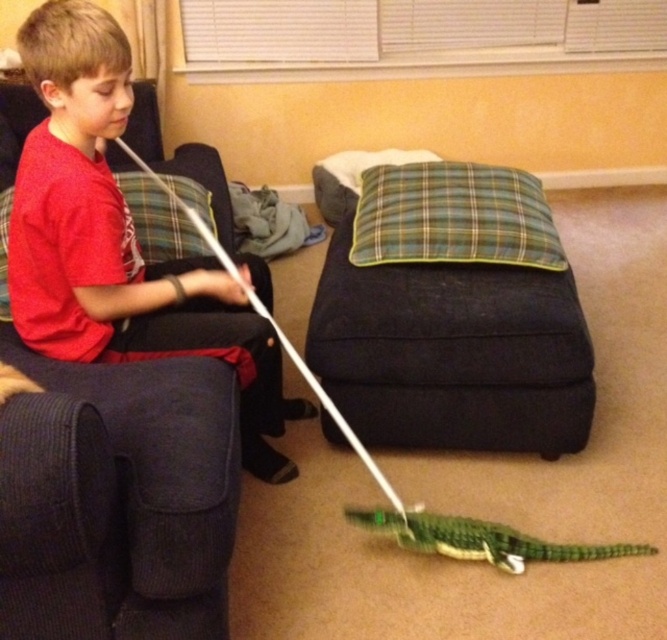
You are a toy robot that needs to place a small cube on the green plaid pillow at center without it falling off. Considering the red matte shirt at left is nearby, which object should you prioritize placing the cube on and why?

The green plaid pillow at center is shorter than the red matte shirt at left, so placing the cube on the red matte shirt at left would provide a more stable base and prevent it from falling off.

You are a toy delivery person who needs to place a small box on the green plaid pillow at center without covering the red matte shirt at left. Can you fit the box on the pillow?

The green plaid pillow at center is smaller than the red matte shirt at left. Since the pillow is smaller, the box might not fit if it is as large as the shirt, but since the box is small, it should fit on the pillow without covering the shirt.